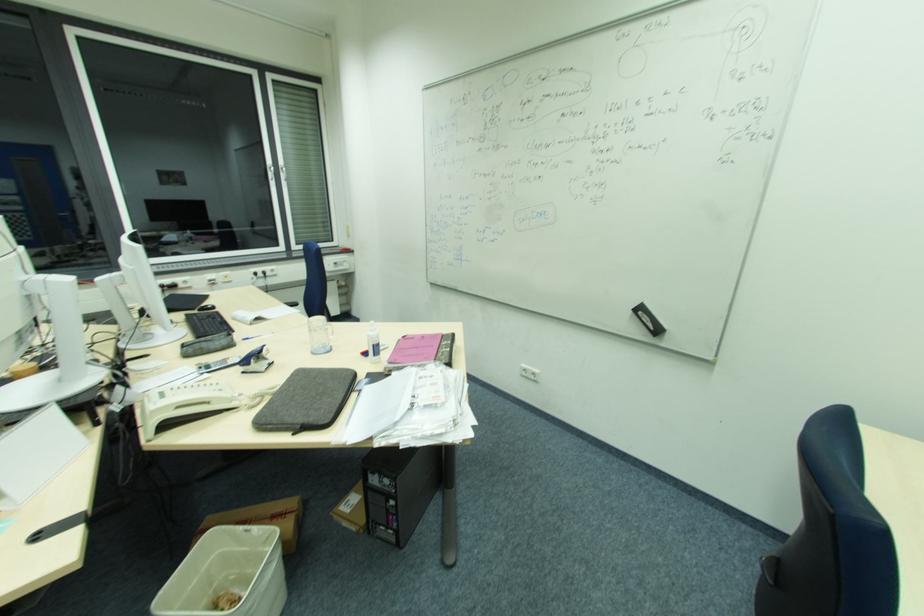
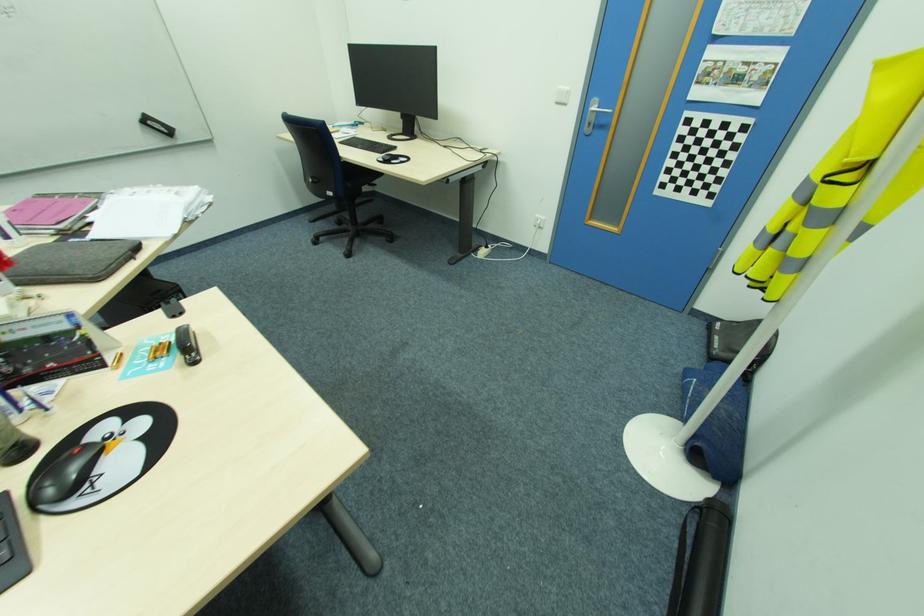
The point at (264, 424) is marked in the first image. Where is the corresponding point in the second image?

(99, 278)